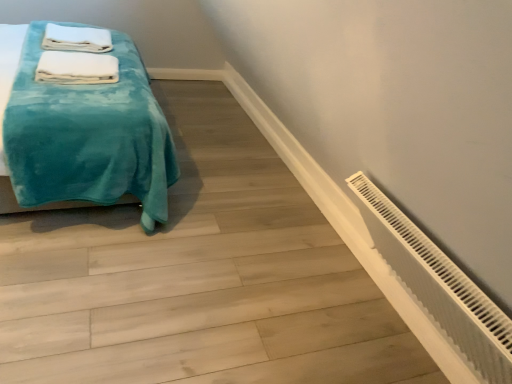
Question: Is the surface of teal plush blanket at left in direct contact with white plastic radiator at lower right?

Choices:
 (A) yes
 (B) no

Answer: (B)

Question: Are teal plush blanket at left and white plastic radiator at lower right far apart?

Choices:
 (A) no
 (B) yes

Answer: (A)

Question: Can you confirm if teal plush blanket at left is smaller than white plastic radiator at lower right?

Choices:
 (A) yes
 (B) no

Answer: (B)

Question: Is white plastic radiator at lower right located within teal plush blanket at left?

Choices:
 (A) yes
 (B) no

Answer: (B)

Question: From a real-world perspective, is teal plush blanket at left physically below white plastic radiator at lower right?

Choices:
 (A) yes
 (B) no

Answer: (B)

Question: Is the position of teal plush blanket at left more distant than that of white plastic radiator at lower right?

Choices:
 (A) no
 (B) yes

Answer: (B)

Question: From a real-world perspective, is white soft towel at upper left, the first bath towel ordered from the bottom, positioned over teal plush blanket at left based on gravity?

Choices:
 (A) no
 (B) yes

Answer: (B)

Question: From a real-world perspective, does white soft towel at upper left, the second bath towel viewed from the back, sit lower than teal plush blanket at left?

Choices:
 (A) yes
 (B) no

Answer: (B)

Question: Is white soft towel at upper left, the second bath towel viewed from the back, smaller than teal plush blanket at left?

Choices:
 (A) yes
 (B) no

Answer: (A)

Question: Is white soft towel at upper left, the second bath towel viewed from the back, taller than teal plush blanket at left?

Choices:
 (A) yes
 (B) no

Answer: (B)

Question: Would you consider white soft towel at upper left, the second bath towel viewed from the back, to be distant from teal plush blanket at left?

Choices:
 (A) no
 (B) yes

Answer: (A)

Question: Does white soft towel at upper left, the 2th bath towel when ordered from top to bottom, have a lesser width compared to teal plush blanket at left?

Choices:
 (A) yes
 (B) no

Answer: (A)

Question: Does white plastic radiator at lower right have a larger size compared to teal plush blanket at left?

Choices:
 (A) yes
 (B) no

Answer: (B)